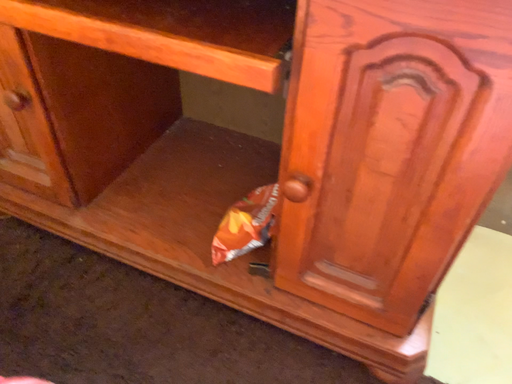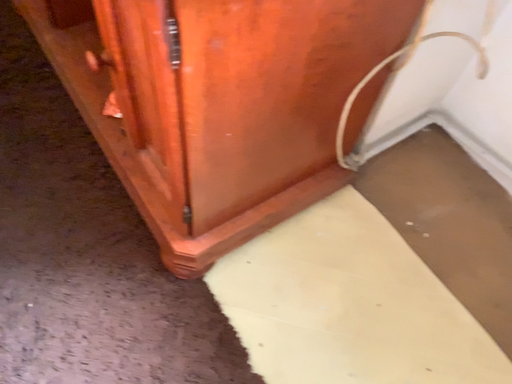
Question: Which way did the camera rotate in the video?

Choices:
 (A) rotated right
 (B) rotated left

Answer: (B)